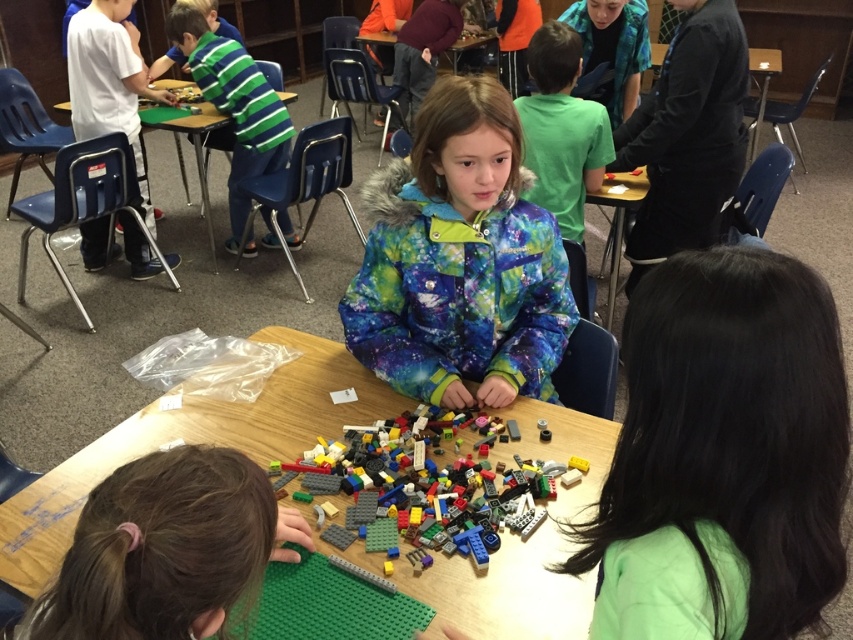
You are a teacher in the classroom and want to ensure that the green matte lego at lower left and the yellow plastic table at right are visible to all students. Considering their heights, which object might need to be placed on a higher surface to be seen better?

The green matte lego at lower left has a lesser height compared to the yellow plastic table at right, so it might need to be placed on a higher surface to be seen better.